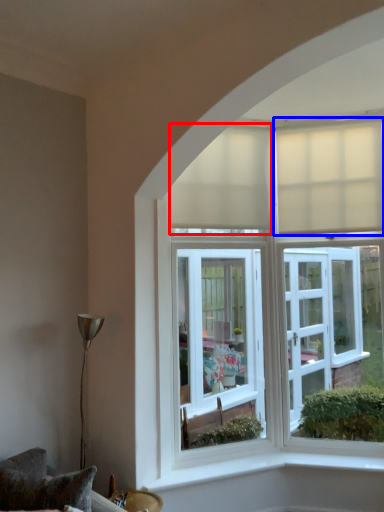
Question: Which point is closer to the camera, curtain (highlighted by a red box) or curtain (highlighted by a blue box)?

Choices:
 (A) curtain
 (B) curtain

Answer: (A)